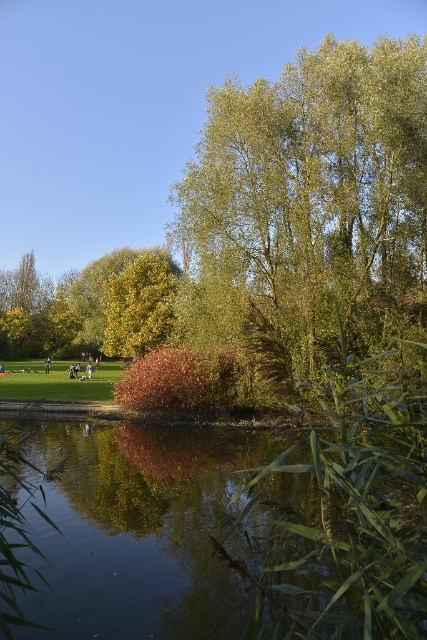
Question: Which object is positioned farthest from the green reflective water at center?

Choices:
 (A) light brown wooden bench at center
 (B) green leafy tree at center
 (C) light brown leather jacket at center
 (D) yellow-green foliage at center

Answer: (C)

Question: Considering the relative positions of green leafy tree at center and yellow-green foliage at center in the image provided, where is green leafy tree at center located with respect to yellow-green foliage at center?

Choices:
 (A) right
 (B) left

Answer: (A)

Question: Which object appears closest to the camera in this image?

Choices:
 (A) light brown leather jacket at center
 (B) light brown wooden bench at center
 (C) green reflective water at center

Answer: (C)

Question: Is green leafy tree at center smaller than green reflective water at center?

Choices:
 (A) no
 (B) yes

Answer: (A)

Question: From the image, what is the correct spatial relationship of green leafy tree at center in relation to light brown wooden bench at center?

Choices:
 (A) left
 (B) right

Answer: (B)

Question: Which of the following is the closest to the observer?

Choices:
 (A) light brown leather jacket at center
 (B) yellow-green foliage at center
 (C) green leafy tree at center

Answer: (C)